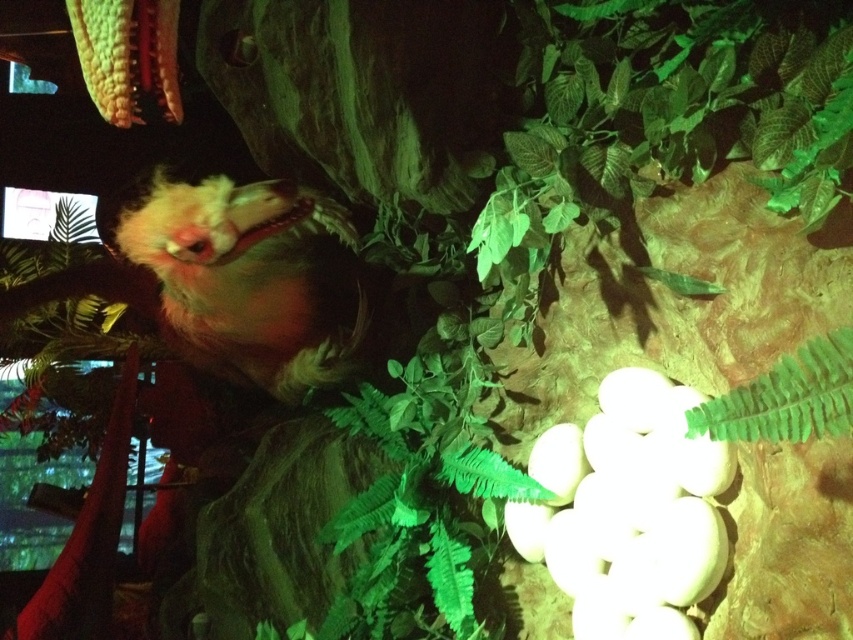
Looking at this image, does fluffy yellow bird at upper left appear on the right side of green leafy fern at lower right?

No, fluffy yellow bird at upper left is not to the right of green leafy fern at lower right.

Between fluffy yellow bird at upper left and green leafy fern at lower right, which one is positioned higher?

Positioned higher is fluffy yellow bird at upper left.

Between point (320, 243) and point (811, 397), which one is positioned in front?

Point (811, 397)

The width and height of the screenshot is (853, 640). I want to click on fluffy yellow bird at upper left, so click(x=254, y=280).